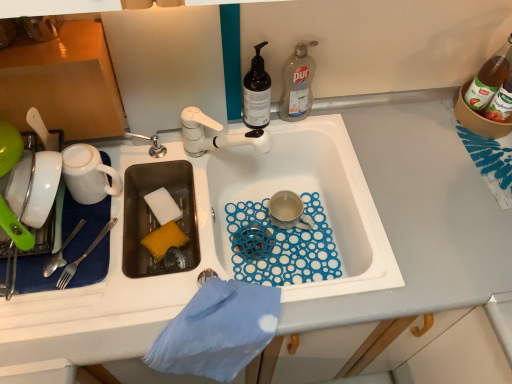
Locate an element on the screen. The image size is (512, 384). unoccupied region to the right of shiny silver fork at left is located at coordinates (139, 270).